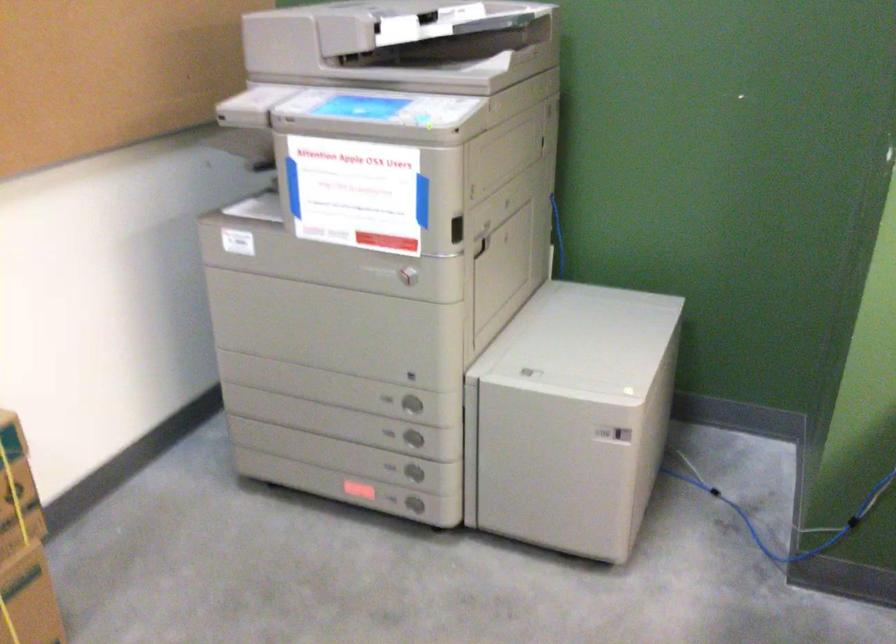
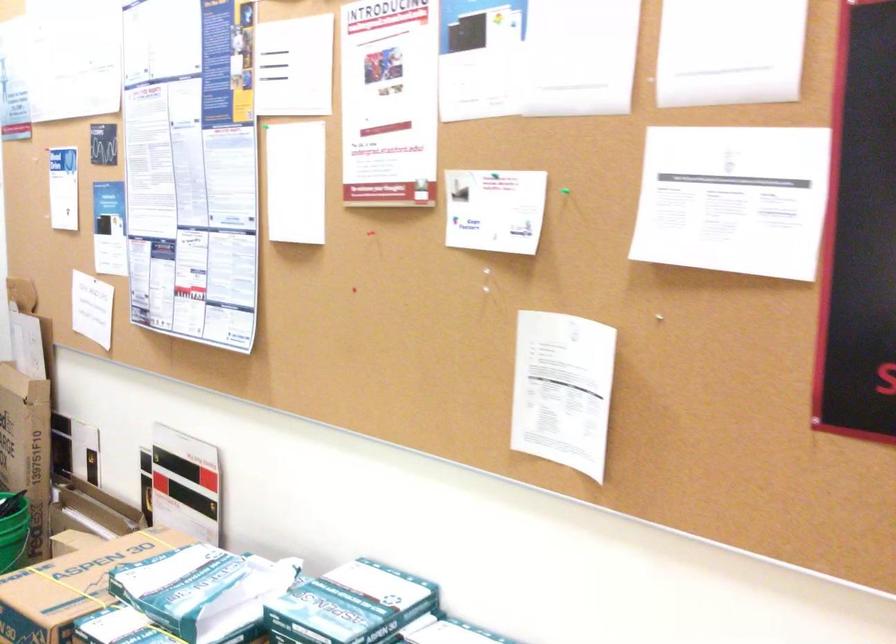
Question: The first image is from the beginning of the video and the second image is from the end. How did the camera likely rotate when shooting the video?

Choices:
 (A) Left
 (B) Right
 (C) Up
 (D) Down

Answer: (A)